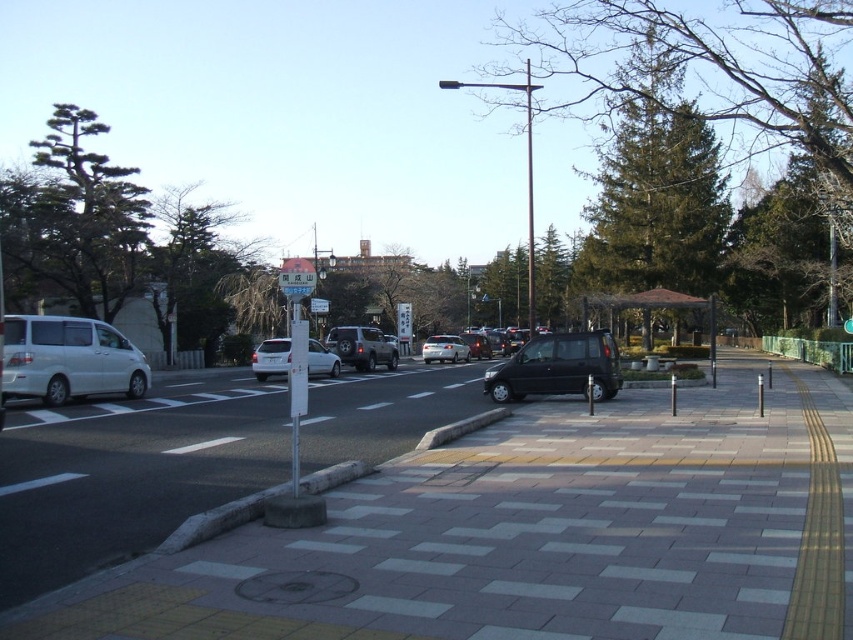
Question: Can you confirm if green textured tree at upper right is thinner than shiny black van at center?

Choices:
 (A) yes
 (B) no

Answer: (B)

Question: Estimate the real-world distances between objects in this image. Which object is farther from the blue plastic street sign at center?

Choices:
 (A) silver metallic hatchback at center
 (B) white matte van at left
 (C) satin silver suv at center
 (D) metallic street sign at center

Answer: (B)

Question: Among these objects, which one is farthest from the camera?

Choices:
 (A) green matte tree at upper left
 (B) shiny black van at center

Answer: (A)

Question: Is blue plastic street sign at center bigger than satin silver suv at center?

Choices:
 (A) no
 (B) yes

Answer: (B)

Question: Is green textured tree at center bigger than blue plastic street sign at center?

Choices:
 (A) no
 (B) yes

Answer: (B)

Question: Which object appears closest to the camera in this image?

Choices:
 (A) silver metallic sedan at center
 (B) white matte van at left
 (C) blue plastic street sign at center

Answer: (C)